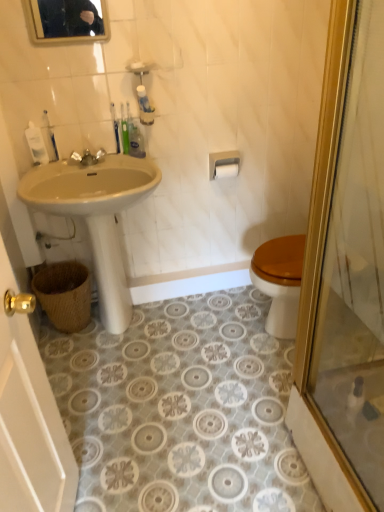
Question: Would you say white plastic bottle at upper left, acting as the 1th toiletry starting from the left, is inside or outside woven brown basket at lower left?

Choices:
 (A) inside
 (B) outside

Answer: (B)

Question: Would you say white plastic bottle at upper left, acting as the 1th toiletry starting from the left, is to the left or to the right of woven brown basket at lower left in the picture?

Choices:
 (A) left
 (B) right

Answer: (A)

Question: Which of these objects is positioned closest to the white plastic toothpaste tube at upper left, which is the 2th toiletry from right to left?

Choices:
 (A) white plastic bottle at upper left, the third toiletry when ordered from right to left
 (B) translucent plastic soap at upper center
 (C) green matte tube at upper center, the first toiletry when ordered from right to left
 (D) gold-framed mirror at upper center
 (E) beige ceramic sink at left

Answer: (A)

Question: Which is farther from the matte white sink at left?

Choices:
 (A) woven brown basket at lower left
 (B) white plastic toothpaste tube at upper left, which appears as the 2th toiletry when viewed from the left
 (C) matte silver faucet at upper center
 (D) beige ceramic sink at left
 (E) white matte toilet paper at upper center

Answer: (E)